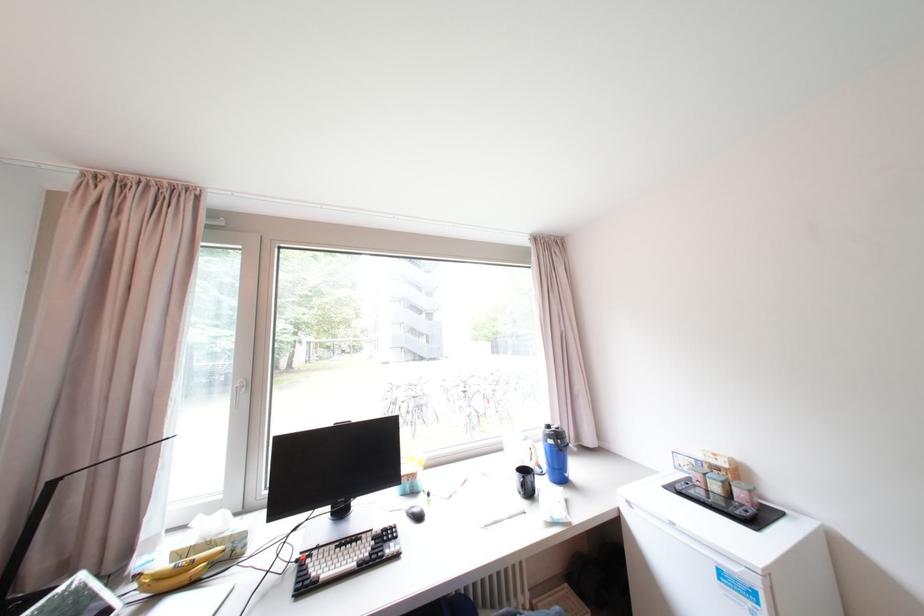
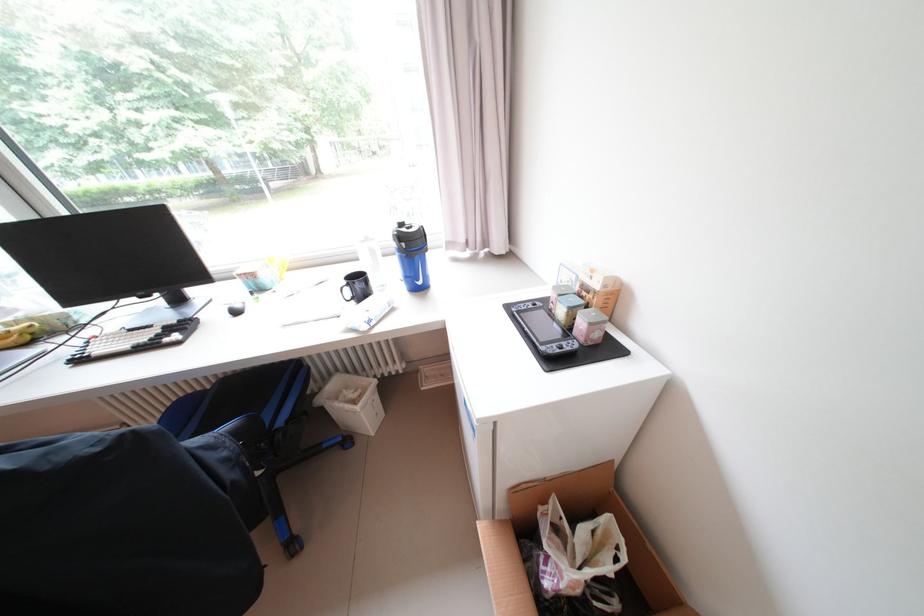
The point at (575,476) is marked in the first image. Where is the corresponding point in the second image?

(428, 284)